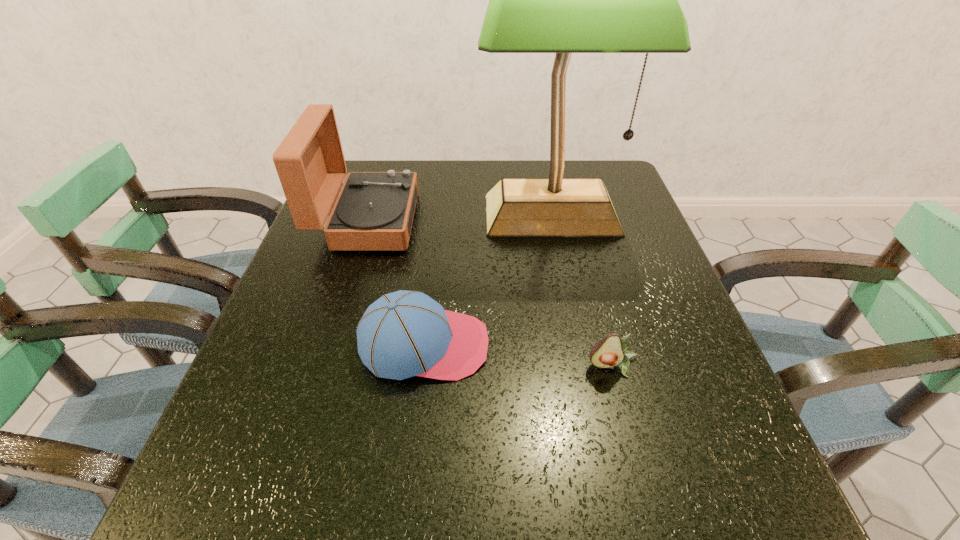
This screenshot has height=540, width=960. Find the location of `table lamp`. table lamp is located at coordinates (563, 0).

The width and height of the screenshot is (960, 540). Find the location of `phonograph record`. phonograph record is located at coordinates (374, 210).

In order to click on baseball cap in this screenshot , I will do `click(403, 334)`.

I want to click on avocado, so click(610, 351).

Where is `free region located 0.110m on the metallic stand of the table lamp`? free region located 0.110m on the metallic stand of the table lamp is located at coordinates (565, 284).

What are the coordinates of `free region located 0.080m on the face of the phonograph record` in the screenshot? It's located at (446, 221).

Image resolution: width=960 pixels, height=540 pixels. I want to click on vacant space situated on the front-facing side of the baseball cap, so click(x=558, y=345).

This screenshot has height=540, width=960. In order to click on free space located on the seed side of the avocado in this screenshot , I will do `click(641, 476)`.

The width and height of the screenshot is (960, 540). Find the location of `table lamp that is at the far edge`. table lamp that is at the far edge is located at coordinates (563, 0).

Where is `phonograph record that is at the far edge`? The height and width of the screenshot is (540, 960). phonograph record that is at the far edge is located at coordinates (374, 210).